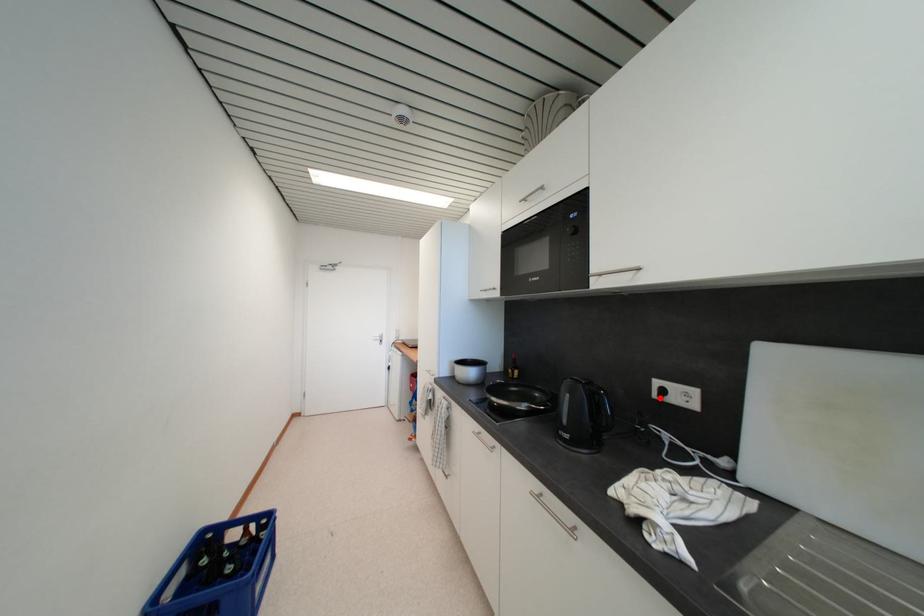
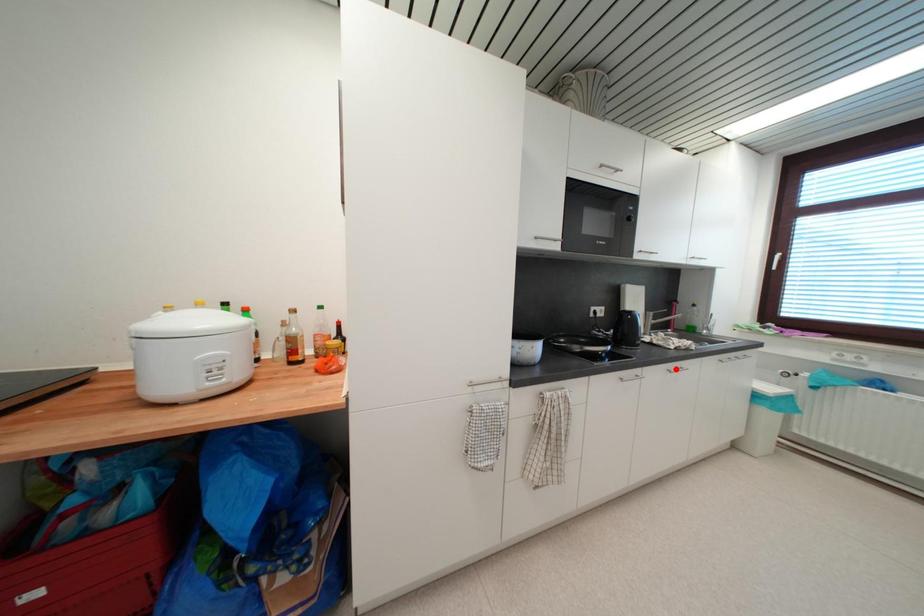
I am providing you with two images of the same scene from different viewpoints. A red point is marked on the first image and another point is marked on the second image. Does the point marked in image1 correspond to the same location as the one in image2?

No